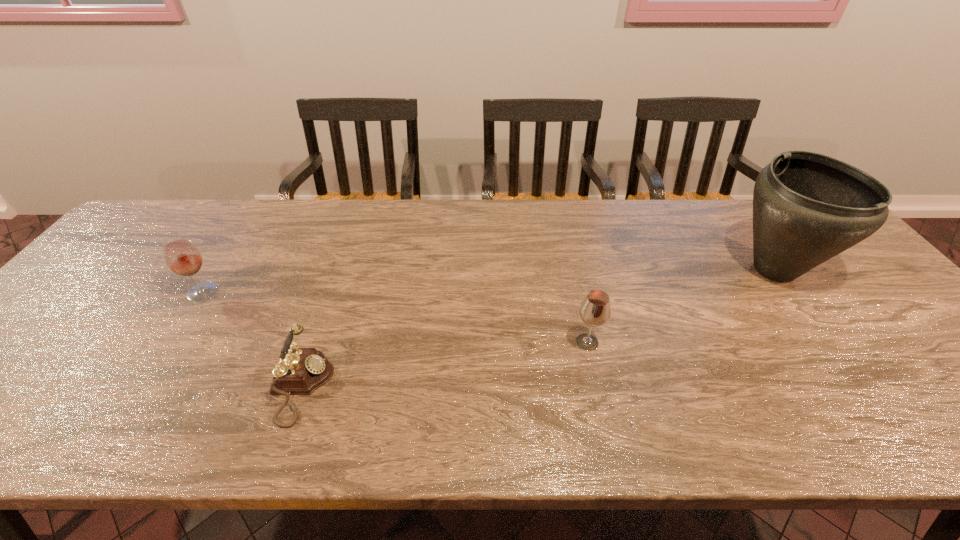
This screenshot has width=960, height=540. Find the location of `the closest object to the nearer wineglass`. the closest object to the nearer wineglass is located at coordinates (807, 207).

This screenshot has height=540, width=960. In order to click on vacant space that satisfies the following two spatial constraints: 1. on the front side of the nearer wineglass; 2. on the dial of the shortest object in this screenshot , I will do `click(597, 386)`.

Image resolution: width=960 pixels, height=540 pixels. What are the coordinates of `vacant position in the image that satisfies the following two spatial constraints: 1. on the back side of the second object from right to left; 2. on the left side of the urn` in the screenshot? It's located at (571, 270).

Where is `vacant area in the image that satisfies the following two spatial constraints: 1. on the front side of the nearer wineglass; 2. on the dial of the telephone`? This screenshot has height=540, width=960. vacant area in the image that satisfies the following two spatial constraints: 1. on the front side of the nearer wineglass; 2. on the dial of the telephone is located at coordinates (597, 386).

At what (x,y) coordinates should I click in order to perform the action: click on vacant space that satisfies the following two spatial constraints: 1. on the front side of the right wineglass; 2. on the dial of the telephone. Please return your answer as a coordinate pair (x, y). Looking at the image, I should click on (597, 386).